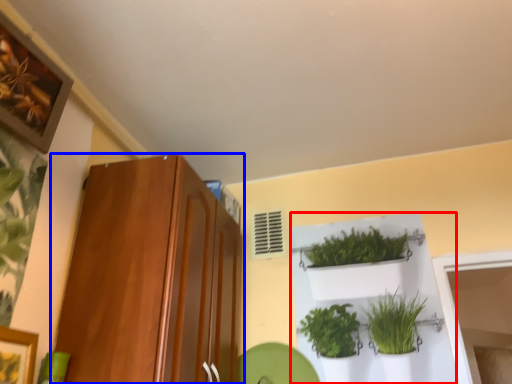
Question: Which point is closer to the camera, shelf (highlighted by a red box) or cabinetry (highlighted by a blue box)?

Choices:
 (A) shelf
 (B) cabinetry

Answer: (B)